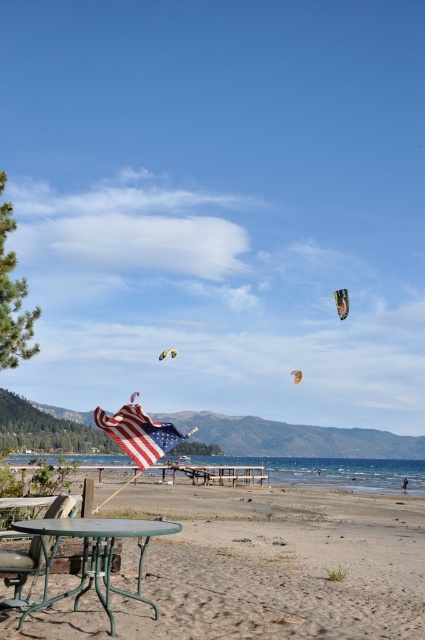
Question: Can you confirm if blue water at lower center is positioned below metallic green chair at lower left?

Choices:
 (A) yes
 (B) no

Answer: (A)

Question: Which of the following is the closest to the observer?

Choices:
 (A) [130, 420]
 (B) [340, 296]

Answer: (A)

Question: Estimate the real-world distances between objects in this image. Which object is farther from the green metal picnic table at lower center?

Choices:
 (A) sandy beach at lower center
 (B) blue water at lower center
 (C) metallic green chair at lower left

Answer: (B)

Question: Is green metal picnic table at lower center closer to the viewer compared to yellow and orange kite at upper center?

Choices:
 (A) yes
 (B) no

Answer: (A)

Question: Which object appears farthest from the camera in this image?

Choices:
 (A) sandy beach at lower center
 (B) yellow-green fabric kite at upper center
 (C) blue water at lower center
 (D) american flag at center

Answer: (C)

Question: Is green metal picnic table at lower center positioned behind american flag at center?

Choices:
 (A) yes
 (B) no

Answer: (B)